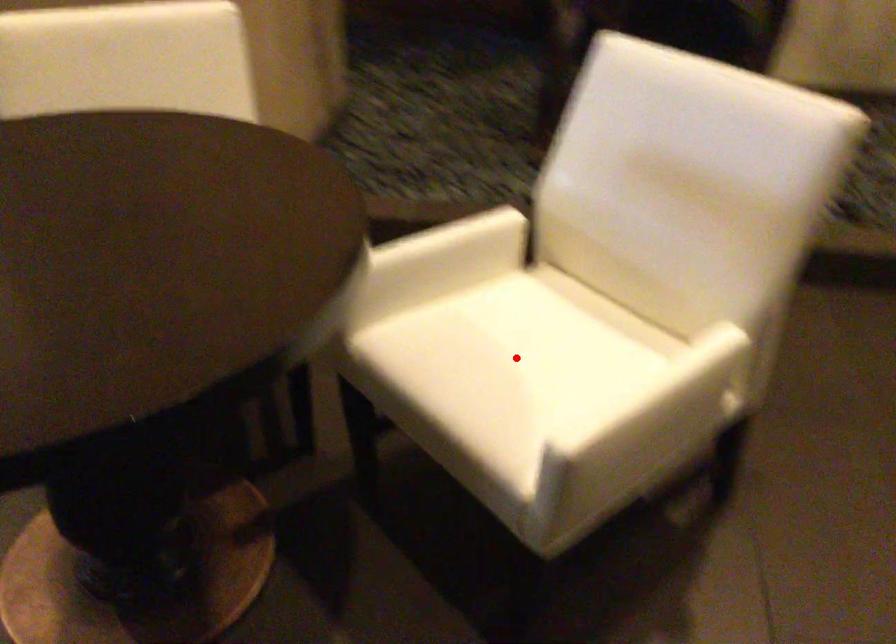
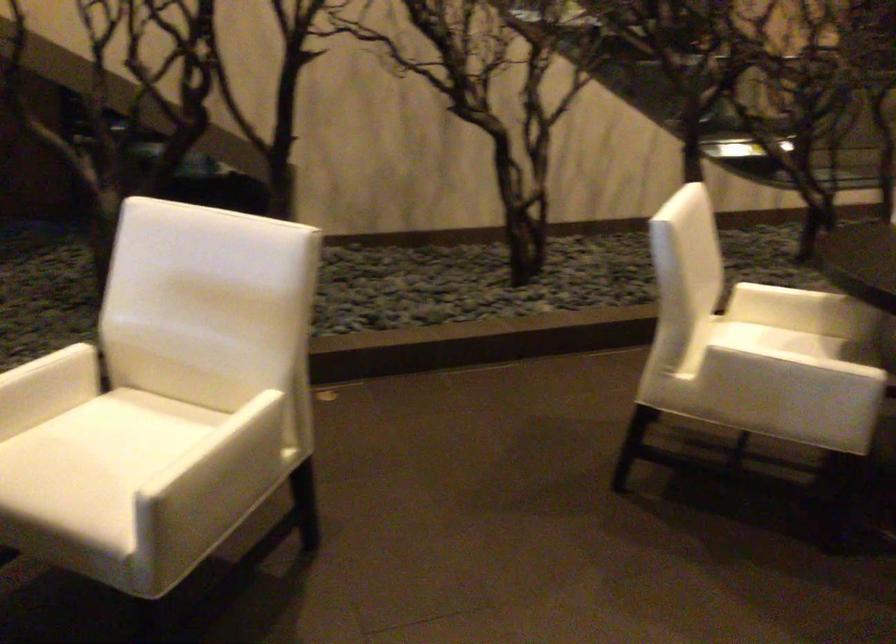
In the second image, find the point that corresponds to the highlighted location in the first image.

(105, 458)